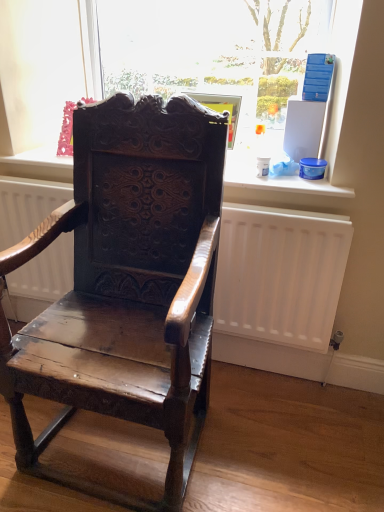
Question: From a real-world perspective, is transparent glass at upper center on top of white matte radiator at center?

Choices:
 (A) no
 (B) yes

Answer: (B)

Question: Does transparent glass at upper center turn towards white matte radiator at center?

Choices:
 (A) yes
 (B) no

Answer: (B)

Question: Is transparent glass at upper center at the right side of white matte radiator at center?

Choices:
 (A) yes
 (B) no

Answer: (A)

Question: From the image's perspective, is transparent glass at upper center on top of white matte radiator at center?

Choices:
 (A) no
 (B) yes

Answer: (B)

Question: Is transparent glass at upper center not close to white matte radiator at center?

Choices:
 (A) no
 (B) yes

Answer: (A)

Question: Would you say white matte radiator at center is inside or outside transparent glass at upper center?

Choices:
 (A) outside
 (B) inside

Answer: (A)

Question: Is white matte radiator at center bigger or smaller than transparent glass at upper center?

Choices:
 (A) small
 (B) big

Answer: (B)

Question: From a real-world perspective, relative to transparent glass at upper center, is white matte radiator at center vertically above or below?

Choices:
 (A) above
 (B) below

Answer: (B)

Question: Considering the positions of white matte radiator at center and transparent glass at upper center in the image, is white matte radiator at center wider or thinner than transparent glass at upper center?

Choices:
 (A) thin
 (B) wide

Answer: (B)

Question: Is transparent glass at upper center to the left or to the right of white matte radiator at center in the image?

Choices:
 (A) left
 (B) right

Answer: (B)

Question: From a real-world perspective, is transparent glass at upper center above or below white matte radiator at center?

Choices:
 (A) above
 (B) below

Answer: (A)

Question: Is transparent glass at upper center wider or thinner than white matte radiator at center?

Choices:
 (A) thin
 (B) wide

Answer: (A)

Question: Is transparent glass at upper center inside the boundaries of white matte radiator at center, or outside?

Choices:
 (A) outside
 (B) inside

Answer: (A)

Question: Based on their sizes in the image, would you say shiny dark wood chair at center is bigger or smaller than white matte radiator at center?

Choices:
 (A) small
 (B) big

Answer: (B)

Question: Would you say shiny dark wood chair at center is to the left or to the right of white matte radiator at center in the picture?

Choices:
 (A) left
 (B) right

Answer: (A)